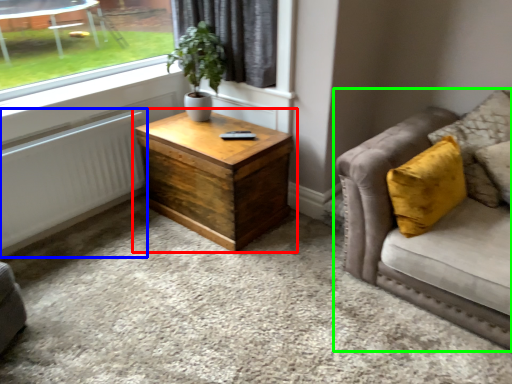
Question: Estimate the real-world distances between objects in this image. Which object is farther from coffee table (highlighted by a red box), radiator (highlighted by a blue box) or studio couch (highlighted by a green box)?

Choices:
 (A) radiator
 (B) studio couch

Answer: (B)